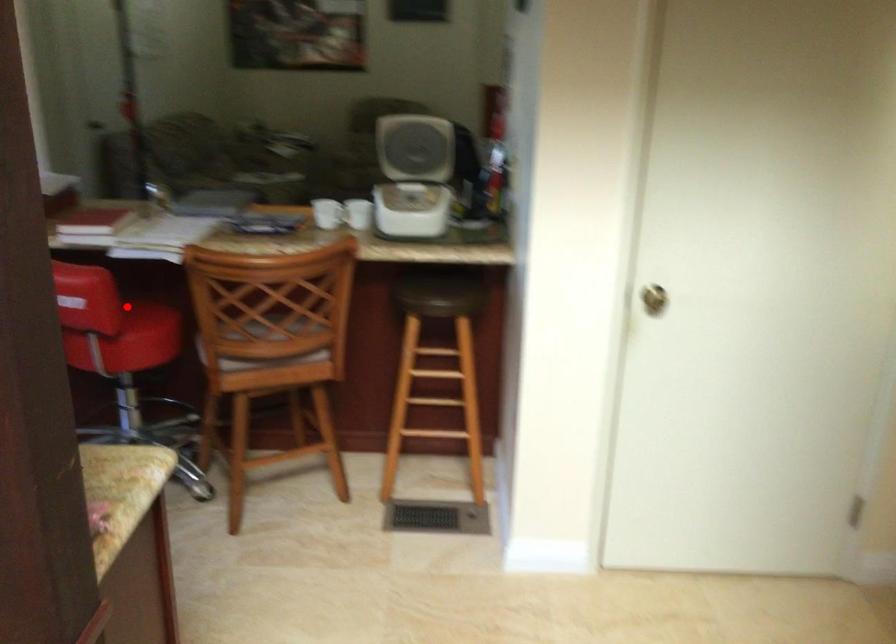
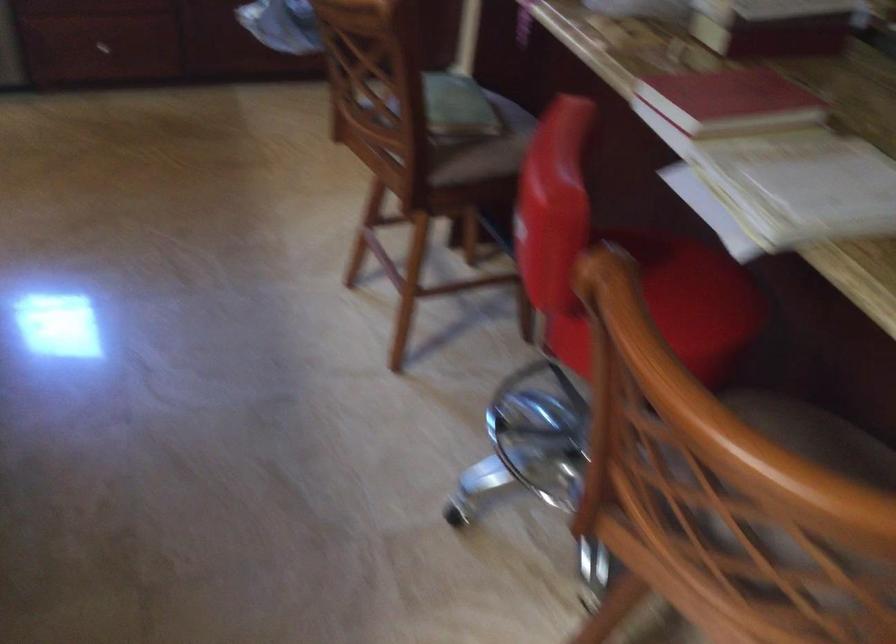
Question: I am providing you with two images of the same scene from different viewpoints. Image1 has a red point marked. In image2, the corresponding 3D location appears at what relative position? Reply with the corresponding letter.

Choices:
 (A) Closer
 (B) Farther

Answer: (A)